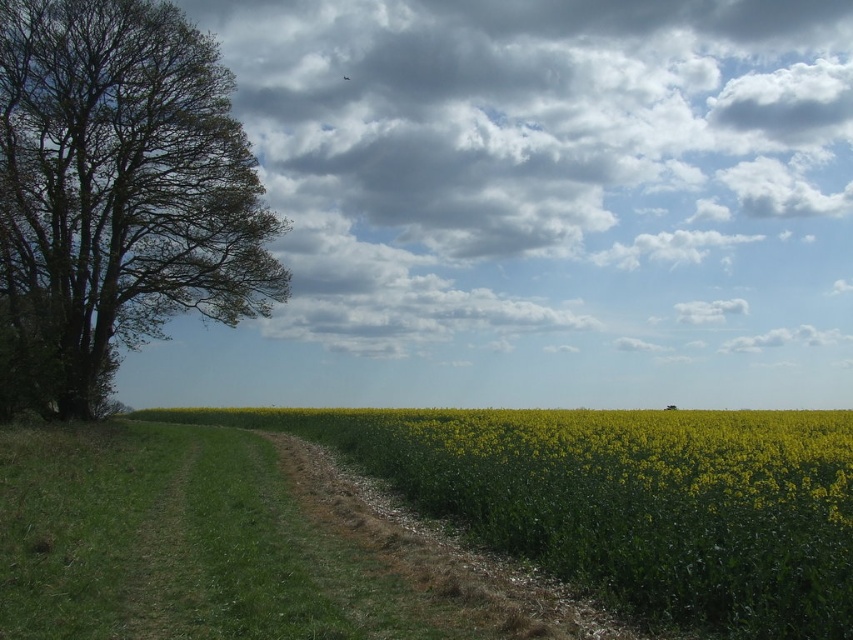
Question: Among these points, which one is nearest to the camera?

Choices:
 (A) (68, 288)
 (B) (407, 570)

Answer: (B)

Question: Among these objects, which one is farthest from the camera?

Choices:
 (A) green leafy tree at left
 (B) cloudy sky at upper center
 (C) brown gravel path at center

Answer: (B)

Question: Is cloudy sky at upper center below brown gravel path at center?

Choices:
 (A) no
 (B) yes

Answer: (A)

Question: Does green leafy tree at left have a greater width compared to brown gravel path at center?

Choices:
 (A) yes
 (B) no

Answer: (A)

Question: Is cloudy sky at upper center positioned in front of green leafy tree at left?

Choices:
 (A) no
 (B) yes

Answer: (A)

Question: Which object is closer to the camera taking this photo?

Choices:
 (A) green leafy tree at left
 (B) cloudy sky at upper center

Answer: (A)